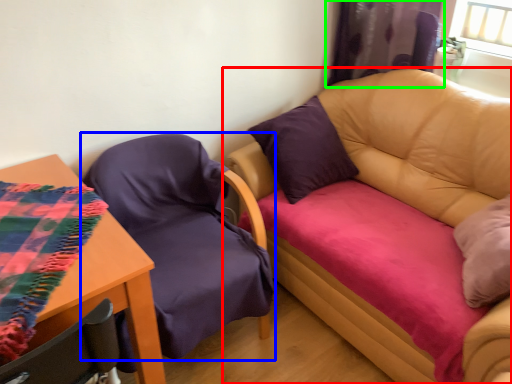
Question: Considering the real-world distances, which object is closest to studio couch (highlighted by a red box)? chair (highlighted by a blue box) or curtain (highlighted by a green box).

Choices:
 (A) chair
 (B) curtain

Answer: (B)